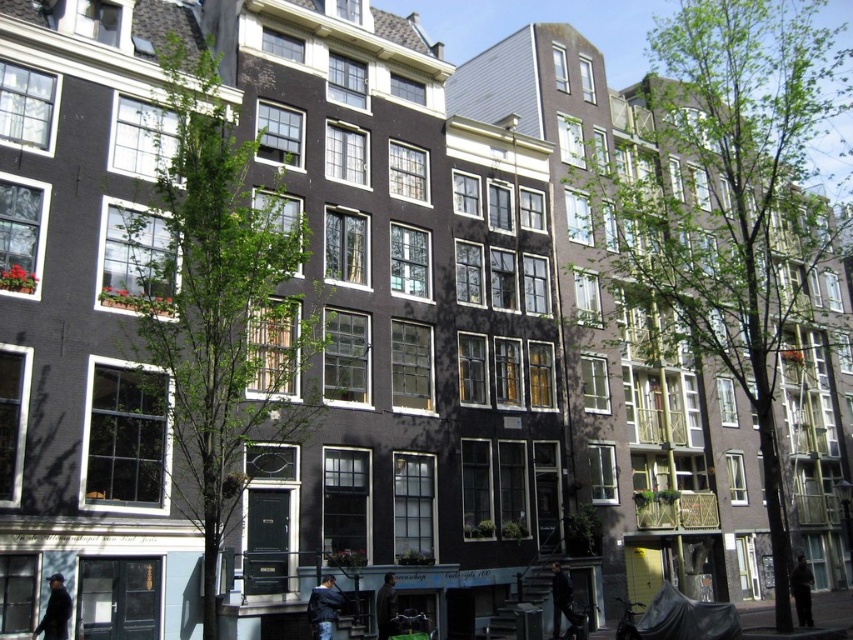
Which of these two, dark gray jacket at lower center or dark brown leather jacket at lower right, stands taller?

dark brown leather jacket at lower right is taller.

Between dark gray jacket at lower center and dark brown leather jacket at lower right, which one has less height?

Standing shorter between the two is dark gray jacket at lower center.

Who is more forward, (556, 572) or (807, 604)?

Point (556, 572) is in front.

The height and width of the screenshot is (640, 853). Identify the location of dark gray jacket at lower center. (561, 600).

Is dark blue jacket at lower left below dark gray jacket at lower center?

Actually, dark blue jacket at lower left is above dark gray jacket at lower center.

Is point (59, 628) closer to camera compared to point (566, 616)?

That is True.

The height and width of the screenshot is (640, 853). Identify the location of dark blue jacket at lower left. (55, 611).

Consider the image. Is dark brown leather jacket at lower right shorter than dark brown leather jacket at lower center?

No.

This screenshot has height=640, width=853. What do you see at coordinates (801, 589) in the screenshot? I see `dark brown leather jacket at lower right` at bounding box center [801, 589].

Which is in front, point (804, 586) or point (395, 596)?

Positioned in front is point (395, 596).

Where is `dark brown leather jacket at lower right`? This screenshot has height=640, width=853. dark brown leather jacket at lower right is located at coordinates (801, 589).